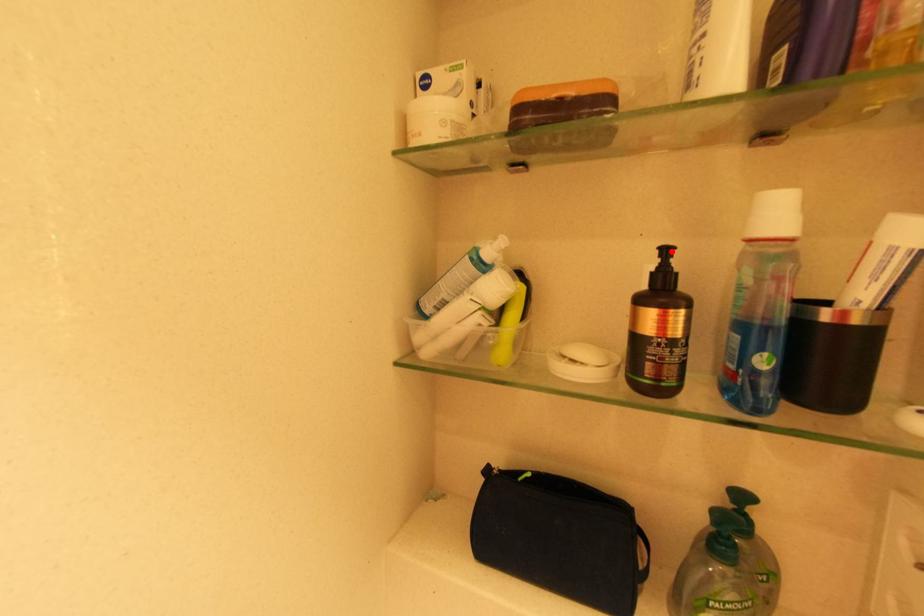
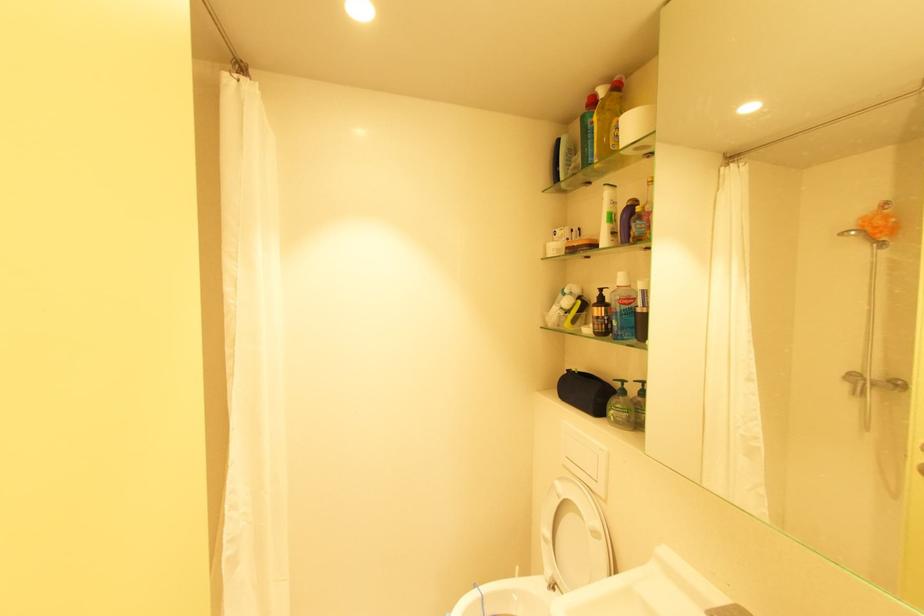
The point at the highlighted location is marked in the first image. Where is the corresponding point in the second image?

(606, 291)